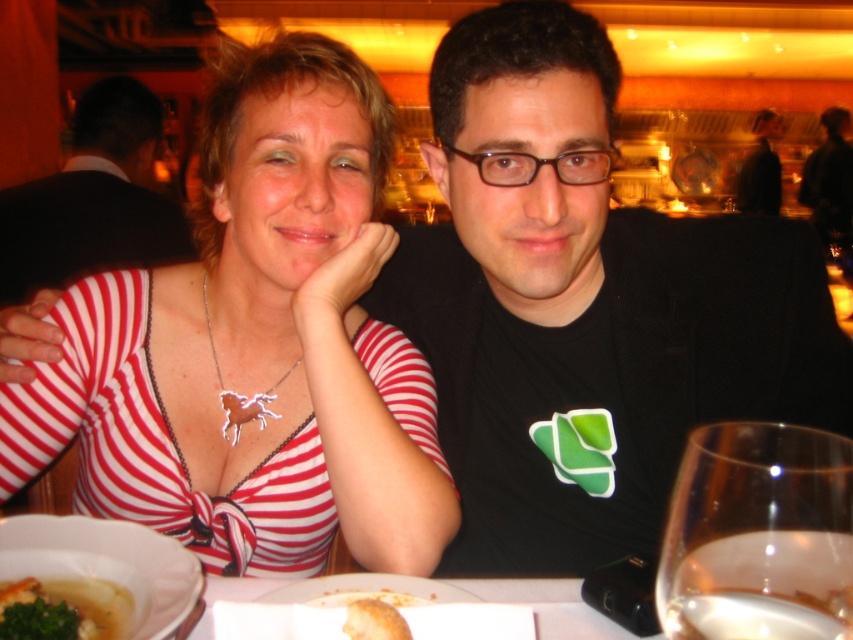
Can you confirm if matte red and white striped dress at center is wider than white creamy soup at lower left?

Yes.

Which is below, matte red and white striped dress at center or white creamy soup at lower left?

white creamy soup at lower left is below.

Does point (321, 108) come in front of point (126, 600)?

No, (321, 108) is behind (126, 600).

At what (x,y) coordinates should I click in order to perform the action: click on matte red and white striped dress at center. Please return your answer as a coordinate pair (x, y). This screenshot has height=640, width=853. Looking at the image, I should click on (256, 348).

Which is below, black matte suit at upper right or golden brown bread at lower center?

golden brown bread at lower center

From the picture: Can you confirm if black matte suit at upper right is wider than golden brown bread at lower center?

Yes.

You are a GUI agent. You are given a task and a screenshot of the screen. Output one action in this format:
    pyautogui.click(x=<x>, y=<y>)
    Task: Click on the black matte suit at upper right
    The height and width of the screenshot is (640, 853).
    Given the screenshot: What is the action you would take?
    coord(759,170)

Locate an element on the screen. Image resolution: width=853 pixels, height=640 pixels. black matte suit at upper right is located at coordinates (759, 170).

Consider the image. Can you confirm if brown plastic glasses at center is smaller than black matte suit at upper right?

Correct, brown plastic glasses at center occupies less space than black matte suit at upper right.

Is brown plastic glasses at center above black matte suit at upper right?

Incorrect, brown plastic glasses at center is not positioned above black matte suit at upper right.

This screenshot has height=640, width=853. What do you see at coordinates (538, 164) in the screenshot?
I see `brown plastic glasses at center` at bounding box center [538, 164].

Locate an element on the screen. This screenshot has width=853, height=640. brown plastic glasses at center is located at coordinates (538, 164).